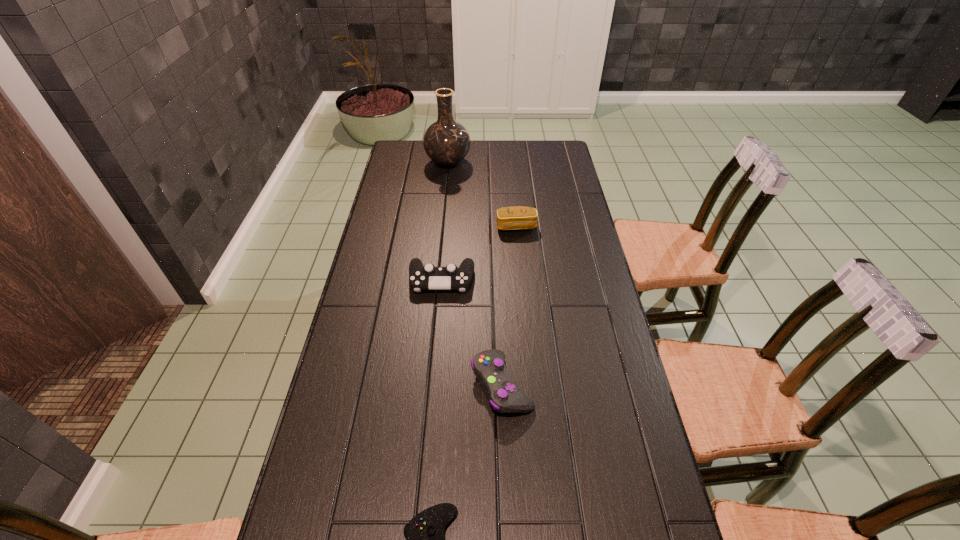
Where is `vase at the left edge`? The height and width of the screenshot is (540, 960). vase at the left edge is located at coordinates (446, 142).

At what (x,y) coordinates should I click in order to perform the action: click on control located at the left edge. Please return your answer as a coordinate pair (x, y). The height and width of the screenshot is (540, 960). Looking at the image, I should click on (428, 277).

The height and width of the screenshot is (540, 960). Find the location of `object at the far left corner`. object at the far left corner is located at coordinates (446, 142).

Locate an element on the screen. This screenshot has height=540, width=960. vacant space at the far edge is located at coordinates (498, 160).

Identify the location of free region at the left edge of the desktop. The height and width of the screenshot is (540, 960). (402, 238).

In the image, there is a desktop. Where is `vacant space at the right edge`? vacant space at the right edge is located at coordinates (583, 276).

You are a GUI agent. You are given a task and a screenshot of the screen. Output one action in this format:
    pyautogui.click(x=<x>, y=<y>)
    Task: Click on the free space that is in between the vase and the second nearest object
    This screenshot has height=540, width=960.
    Given the screenshot: What is the action you would take?
    click(x=475, y=274)

Locate an element on the screen. Image resolution: width=960 pixels, height=540 pixels. vacant space in between the second farthest control and the third nearest object is located at coordinates (471, 332).

Where is `free spot between the clutch bag and the third farthest object`? free spot between the clutch bag and the third farthest object is located at coordinates (479, 253).

Choose which object is the second nearest neighbor to the farthest control. Please provide its 2D coordinates. Your answer should be formatted as a tuple, i.e. [(x, y)], where the tuple contains the x and y coordinates of a point satisfying the conditions above.

[(504, 395)]